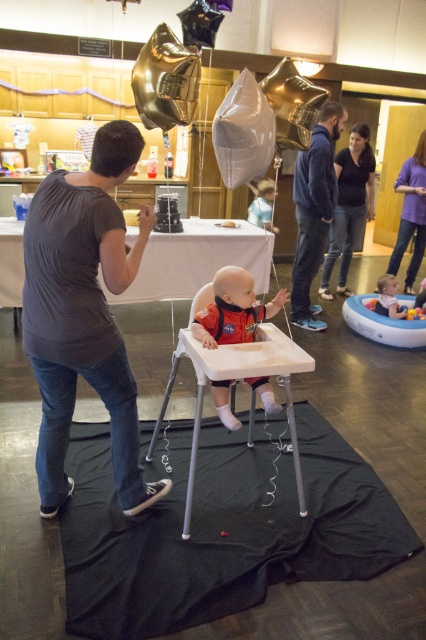
Describe the element at coordinates (235, 380) in the screenshot. I see `white plastic highchair at center` at that location.

Is white plastic highchair at center above rubberized inflatable pool at lower right?

Incorrect, white plastic highchair at center is not positioned above rubberized inflatable pool at lower right.

The width and height of the screenshot is (426, 640). I want to click on white plastic highchair at center, so click(235, 380).

Can you confirm if dark gray t-shirt at left is wider than black smooth shirt at upper center?

No, dark gray t-shirt at left is not wider than black smooth shirt at upper center.

Does dark gray t-shirt at left have a lesser height compared to black smooth shirt at upper center?

Indeed, dark gray t-shirt at left has a lesser height compared to black smooth shirt at upper center.

Describe the element at coordinates (83, 312) in the screenshot. I see `dark gray t-shirt at left` at that location.

At what (x,y) coordinates should I click in order to perform the action: click on dark gray t-shirt at left. Please return your answer as a coordinate pair (x, y). Looking at the image, I should click on (83, 312).

Can you confirm if dark gray t-shirt at left is bigger than gold metallic balloon at upper center?

Yes.

Looking at this image, is dark gray t-shirt at left thinner than gold metallic balloon at upper center?

Incorrect, dark gray t-shirt at left's width is not less than gold metallic balloon at upper center's.

Locate an element on the screen. dark gray t-shirt at left is located at coordinates (83, 312).

Where is `dark gray t-shirt at left`? This screenshot has width=426, height=640. dark gray t-shirt at left is located at coordinates (83, 312).